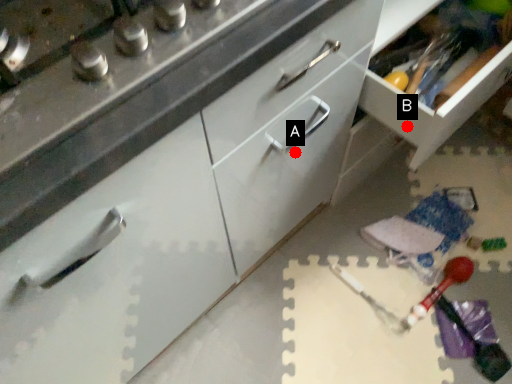
Question: Two points are circled on the image, labeled by A and B beside each circle. Which point is closer to the camera?

Choices:
 (A) A is closer
 (B) B is closer

Answer: (A)